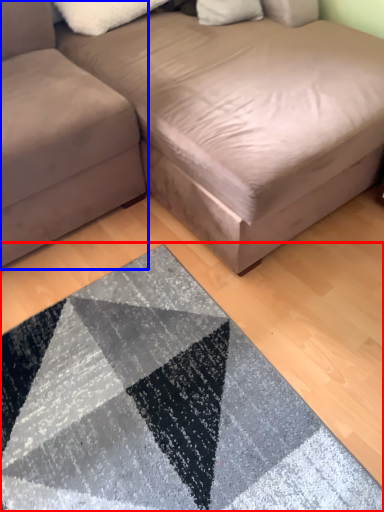
Question: Which point is closer to the camera, mat (highlighted by a red box) or studio couch (highlighted by a blue box)?

Choices:
 (A) mat
 (B) studio couch

Answer: (A)